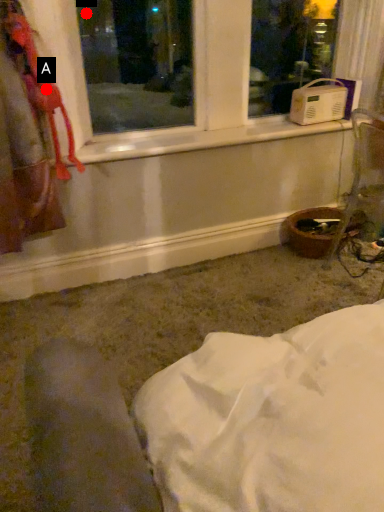
Question: Two points are circled on the image, labeled by A and B beside each circle. Which point appears farthest from the camera in this image?

Choices:
 (A) A is further
 (B) B is further

Answer: (B)